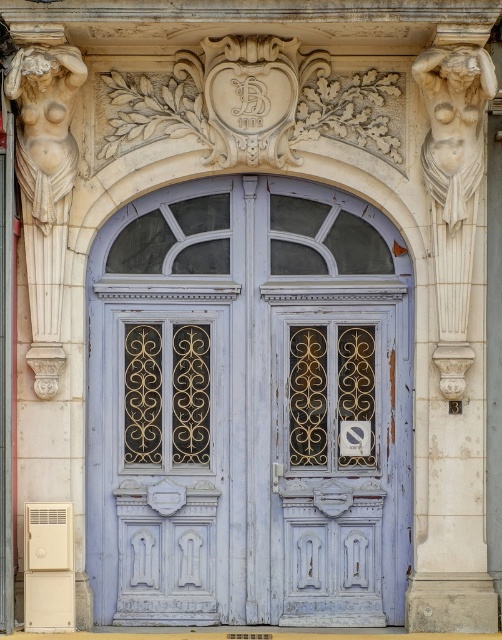
You are standing in front of the entrance and want to see the white marble statue at left. Can you see it clearly from your current position in front of the chipped paint wooden door at center?

The white marble statue at left is behind the chipped paint wooden door at center, so you cannot see it clearly from your current position in front of the chipped paint wooden door at center.

You are an architect examining the door and its decorative elements. You notice a specific point marked at coordinates (339, 451). Based on the scene description, what does this point most likely represent?

The point at (339, 451) indicates the location of the chipped paint on the wooden door at center.